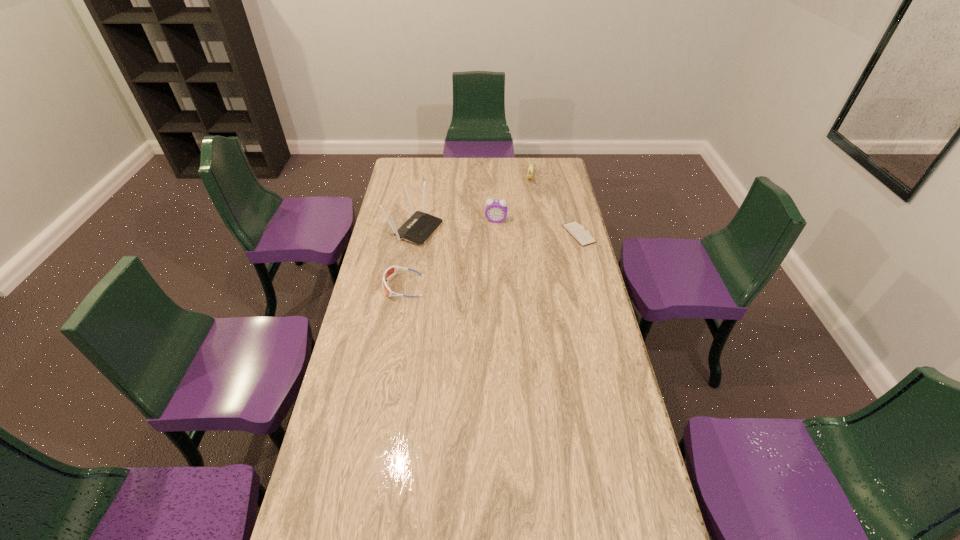
At what (x,y) coordinates should I click in order to perform the action: click on vacant space located on the front of the diary. Please return your answer as a coordinate pair (x, y). This screenshot has width=960, height=540. Looking at the image, I should click on (584, 256).

Where is `vacant space situated 0.170m on the face of the alarm clock`? The width and height of the screenshot is (960, 540). vacant space situated 0.170m on the face of the alarm clock is located at coordinates (491, 248).

What are the coordinates of `vacant region located on the face of the alarm clock` in the screenshot? It's located at (484, 284).

Where is `free spot located 0.290m on the face of the alarm clock`? free spot located 0.290m on the face of the alarm clock is located at coordinates (488, 267).

Identify the location of vacant area situated 0.090m on the front-facing side of the router. (457, 242).

Image resolution: width=960 pixels, height=540 pixels. Identify the location of vacant position located on the front-facing side of the router. (524, 263).

Where is `vacant space located 0.060m on the front-facing side of the router`? vacant space located 0.060m on the front-facing side of the router is located at coordinates (451, 240).

You are a GUI agent. You are given a task and a screenshot of the screen. Output one action in this format:
    pyautogui.click(x=<x>, y=<y>)
    Task: Click on the free region located 0.080m at the stem of the banana
    
    Given the screenshot: What is the action you would take?
    pyautogui.click(x=529, y=195)

Locate an element on the screen. This screenshot has width=960, height=540. vacant space located 0.090m at the stem of the banana is located at coordinates (529, 197).

Where is `vacant region located 0.100m at the stem of the banana`? vacant region located 0.100m at the stem of the banana is located at coordinates (529, 198).